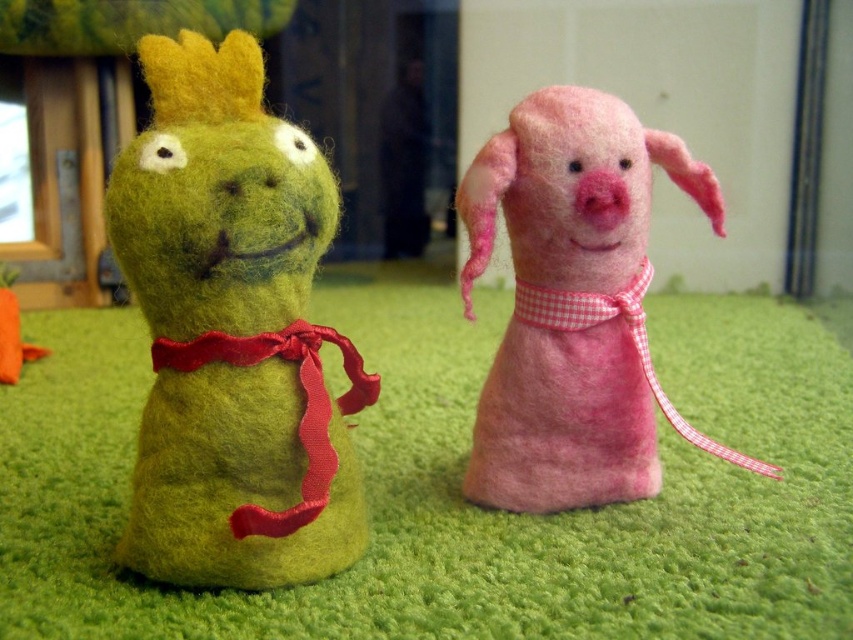
You are a small insect trying to reach the green felt grass at center from the green felt frog at left. Which direction should you move to get there?

The green felt grass at center is to the right of the green felt frog at left, so you should move to the right to reach it.

You are organizing a childrens craft fair and see the pink felt piglet at center and the pink felt apron at center on a table. Which item is positioned higher up on the table?

The pink felt piglet at center is above the pink felt apron at center, so it is positioned higher up on the table.

You are a photographer standing 50 inches away from the green felt grass at center. Can you get a clear closeup shot of the grass without moving closer than your current position?

The green felt grass at center is 35.03 inches away from camera. Since you are currently 50 inches away, you are farther than the grass. To get a clear closeup, you would need to move closer to reduce the distance between yourself and the green felt grass at center.